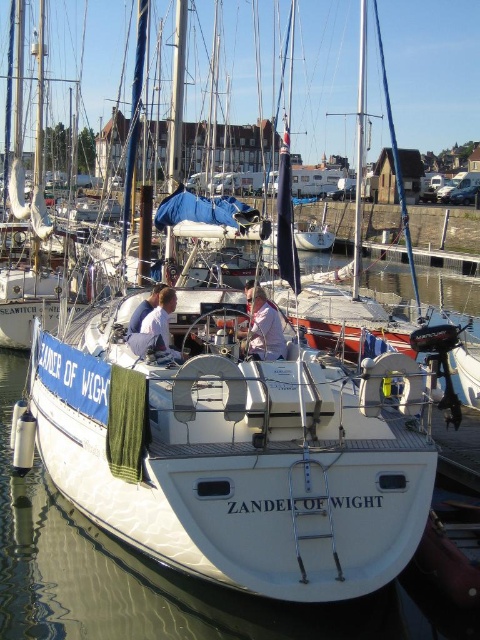
Question: Does pink fabric at center have a larger size compared to white fabric shirt at center?

Choices:
 (A) no
 (B) yes

Answer: (B)

Question: Does pink fabric at center appear on the left side of white fabric shirt at center?

Choices:
 (A) yes
 (B) no

Answer: (B)

Question: Which point appears closest to the camera in this image?

Choices:
 (A) (142, 323)
 (B) (242, 337)

Answer: (A)

Question: Which point appears closest to the camera in this image?

Choices:
 (A) (248, 339)
 (B) (147, 323)

Answer: (B)

Question: Is the position of pink fabric at center less distant than that of white fabric shirt at center?

Choices:
 (A) yes
 (B) no

Answer: (B)